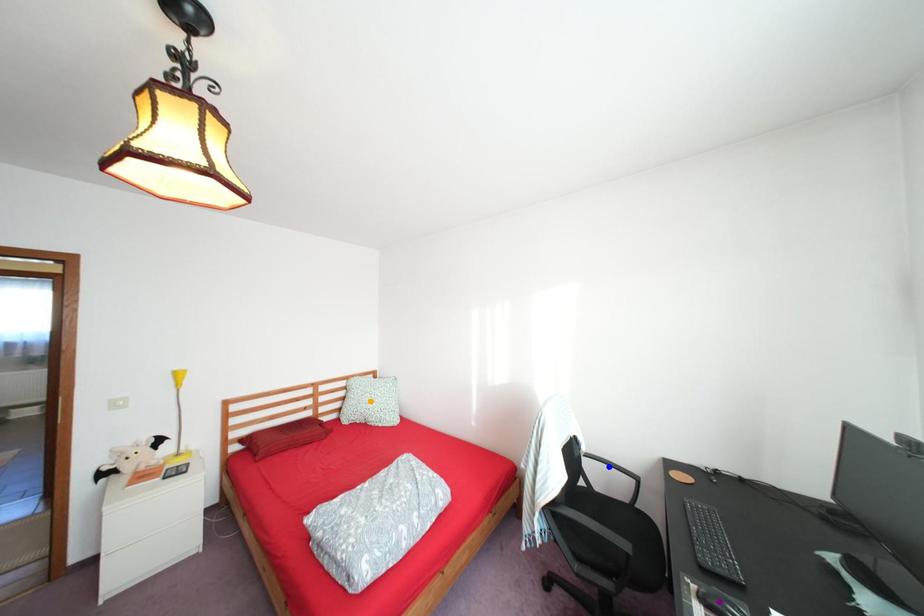
Order these from nearest to farthest:
orange point
purple point
blue point

purple point < blue point < orange point